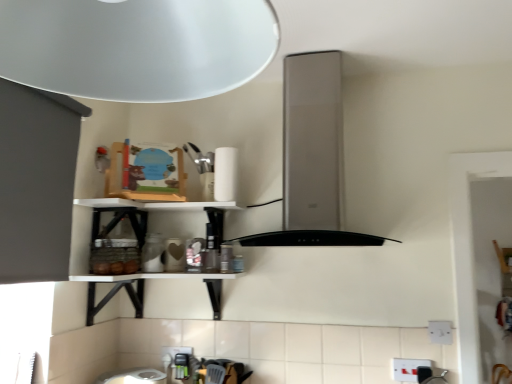
Question: From the image's perspective, is white plastic electric outlet at lower right, positioned as the 1th electric outlet in right-to-left order, located above or below white plastic electric outlet at lower center, which is the 3th electric outlet in top-to-bottom order?

Choices:
 (A) below
 (B) above

Answer: (B)

Question: Looking at their shapes, would you say white plastic electric outlet at lower right, the second electric outlet viewed from the back, is wider or thinner than white plastic electric outlet at lower center, placed as the first electric outlet when sorted from left to right?

Choices:
 (A) wide
 (B) thin

Answer: (A)

Question: Estimate the real-world distances between objects in this image. Which object is farther from the white plastic electric outlet at lower center, the 1th electric outlet viewed from the back?

Choices:
 (A) white plastic electric outlet at lower right, which ranks as the 1th electric outlet in front-to-back order
 (B) satin silver vent at center
 (C) white plastic electric outlet at lower right, positioned as the 1th electric outlet in right-to-left order
 (D) white matte paper towel at upper center

Answer: (C)

Question: Estimate the real-world distances between objects in this image. Which object is closer to the white plastic electric outlet at lower right, the 2th electric outlet ordered from the bottom?

Choices:
 (A) white matte paper towel at upper center
 (B) white plastic electric outlet at lower right, the second electric outlet from the front
 (C) white plastic electric outlet at lower center, which is the 3th electric outlet in top-to-bottom order
 (D) satin silver vent at center

Answer: (B)